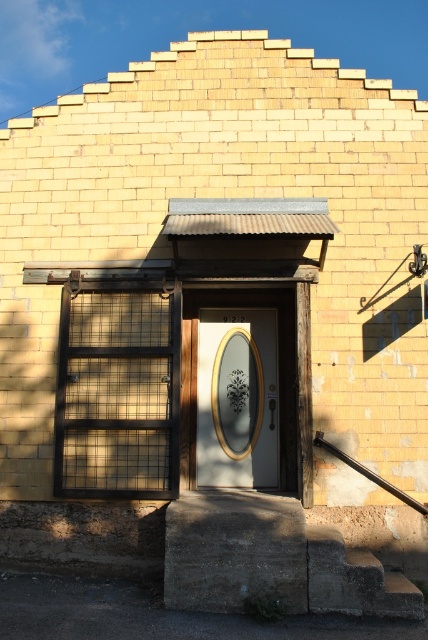
Image resolution: width=428 pixels, height=640 pixels. What do you see at coordinates (237, 397) in the screenshot?
I see `matte gold door at center` at bounding box center [237, 397].

Does point (234, 410) lie behind point (323, 566)?

Yes, point (234, 410) is behind point (323, 566).

Find the location of a particular element. The image size is (428, 640). matte gold door at center is located at coordinates (237, 397).

Can you confirm if concrete/stone stairs at lower center is smaller than brown wooden rail at right?

Actually, concrete/stone stairs at lower center might be larger than brown wooden rail at right.

Is concrete/stone stairs at lower center taller than brown wooden rail at right?

In fact, concrete/stone stairs at lower center may be shorter than brown wooden rail at right.

Does point (371, 596) lie behind point (422, 513)?

That is False.

Where is `concrete/stone stairs at lower center`? Image resolution: width=428 pixels, height=640 pixels. concrete/stone stairs at lower center is located at coordinates (354, 579).

In the scene shown: Between matte gold door at center and brown wooden rail at right, which one is positioned higher?

matte gold door at center is above.

Can you confirm if matte gold door at center is positioned below brown wooden rail at right?

Incorrect, matte gold door at center is not positioned below brown wooden rail at right.

Does point (232, 348) come farther from viewer compared to point (347, 458)?

Yes, point (232, 348) is behind point (347, 458).

What are the coordinates of `matte gold door at center` in the screenshot? It's located at (237, 397).